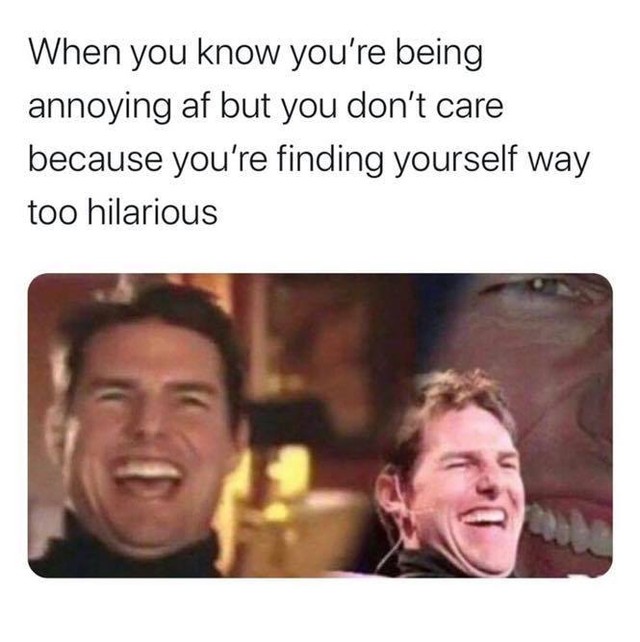
The image size is (640, 642). Find the location of `light`. light is located at coordinates (291, 474), (243, 476), (280, 519).